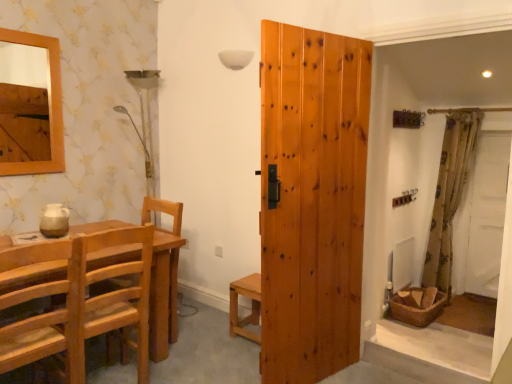
Identify the location of vacant area that is situated to the right of light brown wooden chair at left, the 1th chair when ordered from back to front. (180, 368).